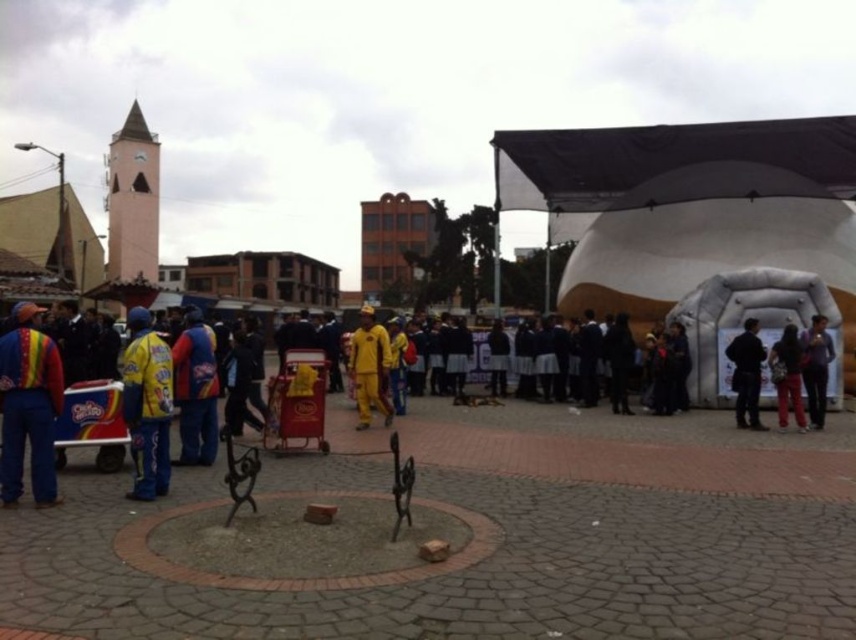
Question: Is yellow fabric jacket at center above yellow fabric outfit at center?

Choices:
 (A) yes
 (B) no

Answer: (B)

Question: Does yellow fabric jacket at left lie behind dark blue fabric jacket at right?

Choices:
 (A) no
 (B) yes

Answer: (A)

Question: Which point is farther to the camera?

Choices:
 (A) (0, 460)
 (B) (146, 419)
 (C) (212, 336)
 (D) (821, 365)

Answer: (D)

Question: Which object appears closest to the camera in this image?

Choices:
 (A) dark blue fabric jacket at right
 (B) yellow fabric jacket at center
 (C) yellow fabric jacket at left
 (D) rainbow striped vest at left

Answer: (D)

Question: Does black matte jacket at right have a smaller size compared to dark blue fabric jacket at right?

Choices:
 (A) yes
 (B) no

Answer: (B)

Question: Which point appears farthest from the camera in this image?

Choices:
 (A) (214, 376)
 (B) (58, 378)
 (C) (741, 342)
 (D) (417, 448)

Answer: (C)